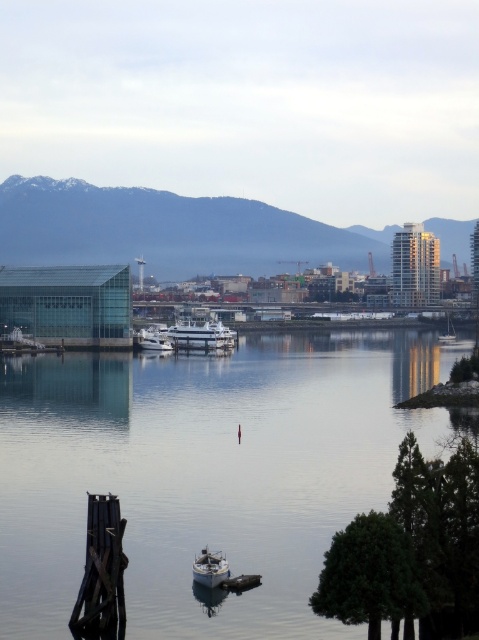
You need to navigate a small boat from the white glossy boat at center to the white matte sailboat at right. Which direction should you steer your boat to reach the sailboat?

You should steer your boat to the right to reach the white matte sailboat at right since the white glossy boat at center is located to its left.

You are standing on the dock and want to board the white glossy yacht at center and the white matte sailboat at right. Which vessel will you reach first if you walk straight ahead?

The white glossy yacht at center is closer to the viewer than the white matte sailboat at right, so you will reach the white glossy yacht at center first.